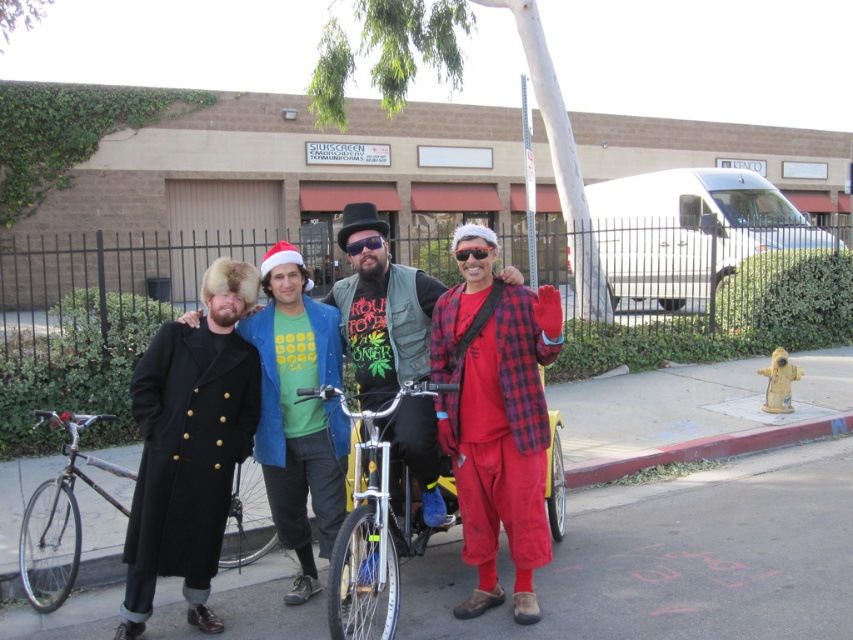
Question: Is red flannel shirt at center wider than black wool coat at left?

Choices:
 (A) yes
 (B) no

Answer: (A)

Question: Which point is farther to the camera?

Choices:
 (A) silver metallic bicycle at center
 (B) red flannel shirt at center
 (C) black wool coat at center
 (D) shiny silver bicycle at left

Answer: (D)

Question: Does smooth asphalt at center have a larger size compared to black wool coat at center?

Choices:
 (A) yes
 (B) no

Answer: (B)

Question: Based on their relative distances, which object is farther from the red flannel shirt at center?

Choices:
 (A) silver metallic bicycle at center
 (B) shiny silver bicycle at left
 (C) black wool coat at left
 (D) smooth asphalt at center

Answer: (D)

Question: Where is silver metallic bicycle at center located in relation to shiny silver bicycle at left in the image?

Choices:
 (A) right
 (B) left

Answer: (A)

Question: Which of these objects is positioned farthest from the red flannel shirt at center?

Choices:
 (A) black wool coat at center
 (B) black wool coat at left
 (C) silver metallic bicycle at center

Answer: (A)